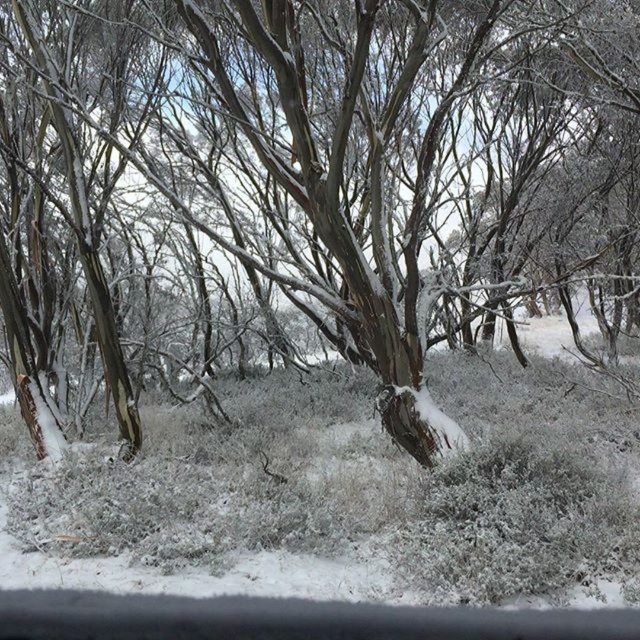
You are standing in the winter forest scene. There are two points marked in the image. The first point is located at coordinates point (620,54) and the second at point (536,500). If you were to walk towards both points, which one would you reach first?

Point (620,54) is closer to you than point (536,500), so you would reach it first.

You are standing in the winter forest scene and want to locate the smooth bark tree at center. According to the coordinates provided, where exactly would you find it?

The smooth bark tree at center is located at the 2D coordinates point (346,157).

You are an animal looking for shelter in the winter forest scene. You see the smooth bark tree at center and the white fluffy grass at center. Which one would provide better protection from the cold wind?

The smooth bark tree at center has a larger size compared to the white fluffy grass at center, so it would provide better protection from the cold wind.